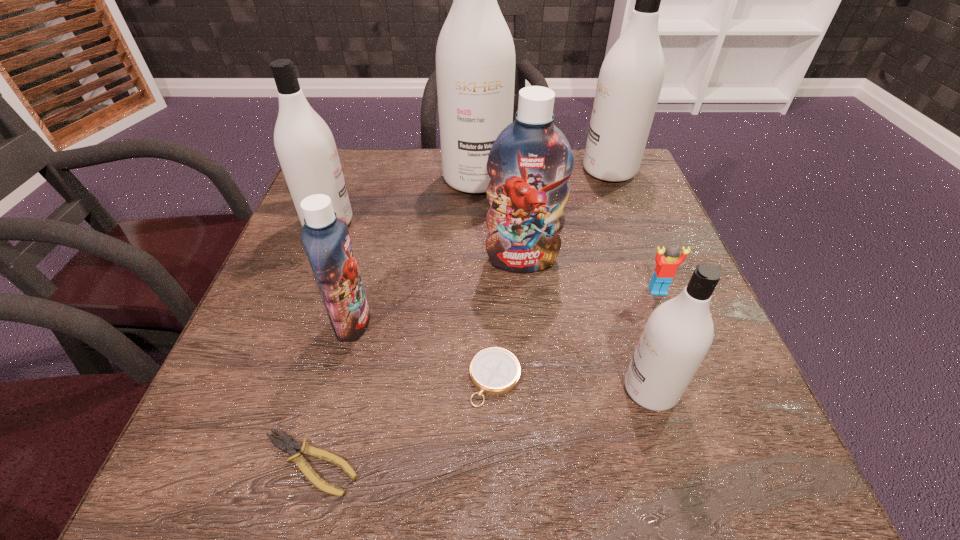
Image resolution: width=960 pixels, height=540 pixels. What are the coordinates of `free location located on the front-facing side of the third smallest white shampoo` in the screenshot? It's located at (512, 171).

I want to click on vacant space located on the front-facing side of the third farthest shampoo, so click(x=486, y=222).

What are the coordinates of `vacant area situated on the front label of the right blue shampoo` in the screenshot? It's located at (540, 438).

Where is `vacant area situated 0.200m on the front label of the fifth shampoo from right to left`? This screenshot has width=960, height=540. vacant area situated 0.200m on the front label of the fifth shampoo from right to left is located at coordinates (477, 321).

You are a GUI agent. You are given a task and a screenshot of the screen. Output one action in this format:
    pyautogui.click(x=<x>, y=<y>)
    Task: Click on the vacant area located 0.080m on the front-facing side of the nearest shampoo
    This screenshot has width=960, height=540.
    Given the screenshot: What is the action you would take?
    pyautogui.click(x=574, y=389)

Image resolution: width=960 pixels, height=540 pixels. I want to click on free space located on the front-facing side of the nearest shampoo, so click(x=421, y=389).

I want to click on vacant space located on the front-facing side of the nearest shampoo, so click(507, 389).

At what (x,y) coordinates should I click in order to perform the action: click on vacant space located 0.110m on the face of the third shortest object. Please return your answer as a coordinate pair (x, y). Looking at the image, I should click on (677, 341).

Locate an element on the screen. Image resolution: width=960 pixels, height=540 pixels. vacant region located on the right of the compass is located at coordinates (604, 379).

At what (x,y) coordinates should I click in order to perform the action: click on vacant space located on the right of the nearest object. Please return your answer as a coordinate pair (x, y). The height and width of the screenshot is (540, 960). Looking at the image, I should click on (395, 463).